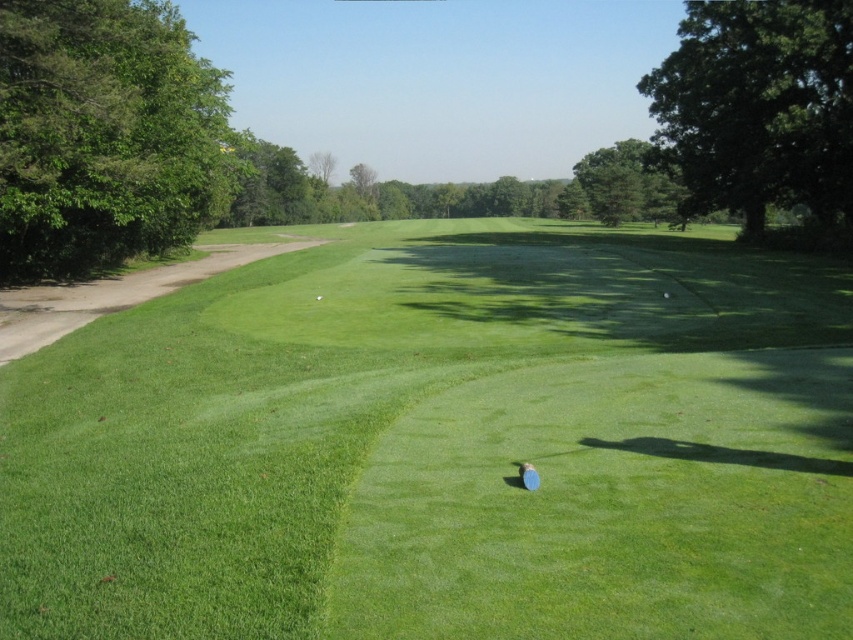
You are standing at the edge of the green on the golf course and want to reach the point marked at coordinates point (608, 260). If your golf cart can travel 10 meters per minute, how long will it take to reach that point?

The distance between you and point (608, 260) is 32.20 meters. At a speed of 10 meters per minute, it will take approximately 3.22 minutes to reach the point.

You are a golfer trying to hit the green rubber golf ball at center from the green grassy golf course at center. Can you see the ball clearly from your position on the course?

The green rubber golf ball at center is smaller than the green grassy golf course at center, so it might be difficult to see clearly from a distance.